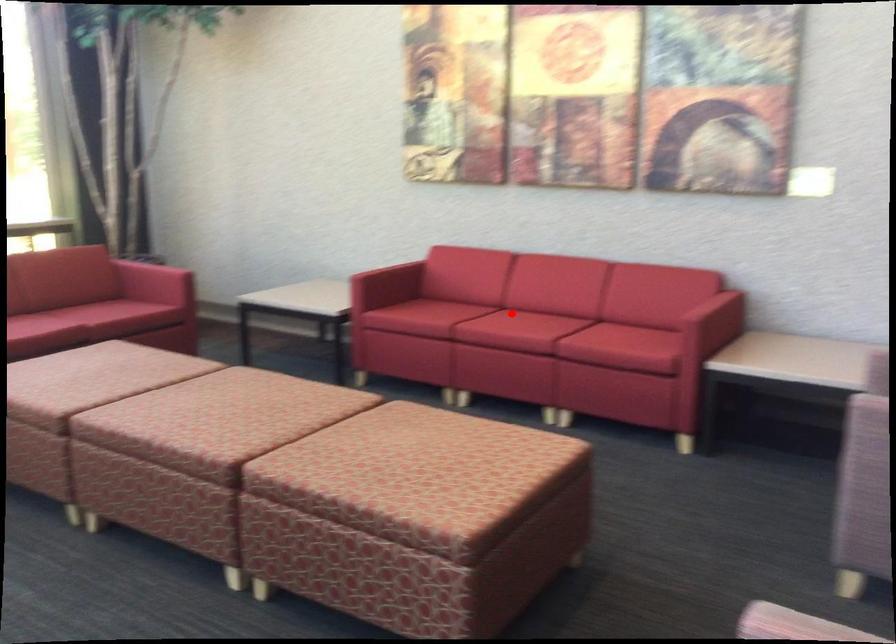
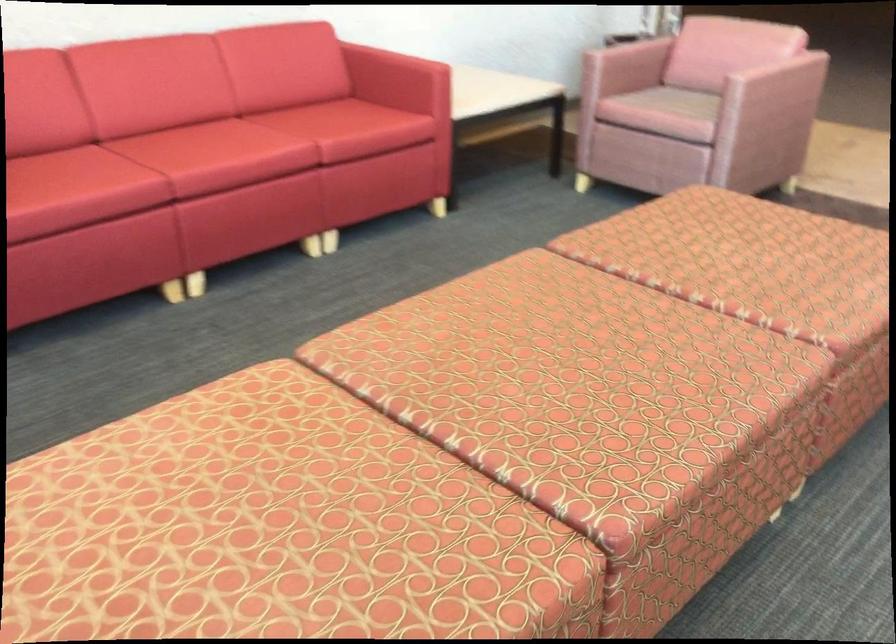
Question: A red point is marked in image1. In image2, is the corresponding 3D point closer to the camera or farther? Reply with the corresponding letter.

Choices:
 (A) The corresponding 3D point is closer.
 (B) The corresponding 3D point is farther.

Answer: (A)